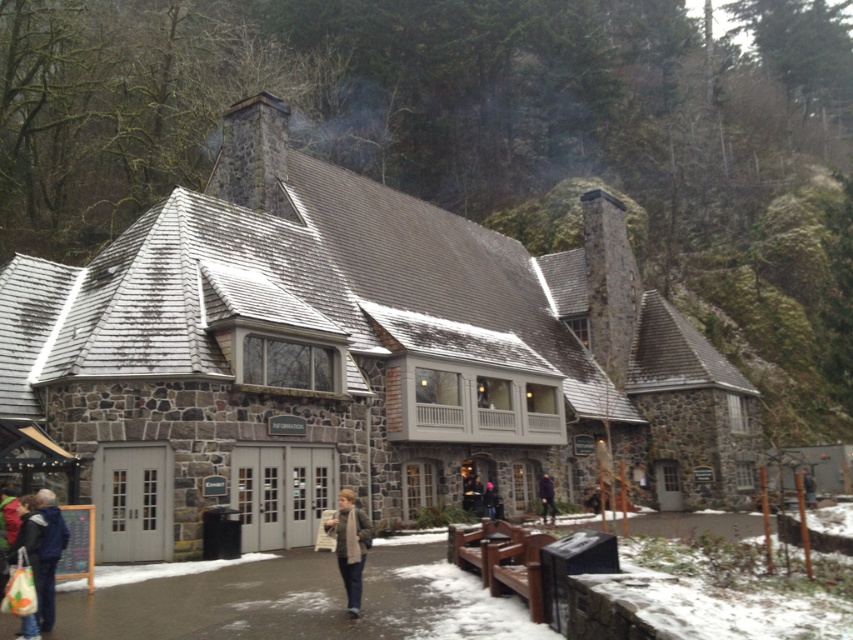
Question: Does green wool scarf at center appear on the left side of purple matte jacket at center?

Choices:
 (A) yes
 (B) no

Answer: (A)

Question: Among these points, which one is farthest from the camera?

Choices:
 (A) [x=554, y=509]
 (B) [x=352, y=600]

Answer: (A)

Question: Which of the following is the farthest from the observer?

Choices:
 (A) (546, 515)
 (B) (370, 531)

Answer: (A)

Question: Which of the following is the farthest from the observer?

Choices:
 (A) (341, 524)
 (B) (544, 474)

Answer: (B)

Question: Does green wool scarf at center have a larger size compared to purple matte jacket at center?

Choices:
 (A) yes
 (B) no

Answer: (A)

Question: In this image, where is green wool scarf at center located relative to purple matte jacket at center?

Choices:
 (A) left
 (B) right

Answer: (A)